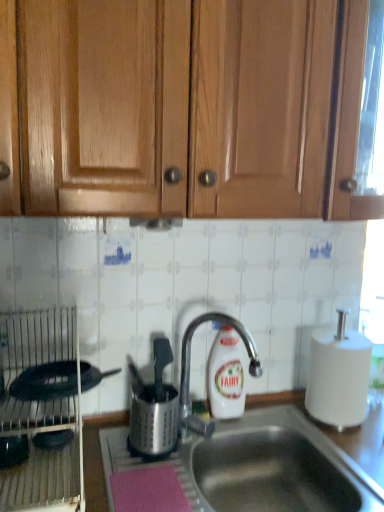
Question: From the image's perspective, is white plastic bottle at center located above or below wooden cabinet doors at upper center?

Choices:
 (A) below
 (B) above

Answer: (A)

Question: Looking at the image, does white plastic bottle at center seem bigger or smaller compared to wooden cabinet doors at upper center?

Choices:
 (A) big
 (B) small

Answer: (B)

Question: Which object is positioned farthest from the white matte paper towel at right?

Choices:
 (A) wooden cabinet doors at upper center
 (B) white plastic bottle at center
 (C) satin silver utensil holder at center, the 1th appliance from the right
 (D) stainless steel sink at center
 (E) silver metallic faucet at center

Answer: (A)

Question: Based on their relative distances, which object is farther from the wooden cabinet doors at upper center?

Choices:
 (A) satin silver utensil holder at center, which is counted as the 2th appliance, starting from the left
 (B) silver metallic faucet at center
 (C) stainless steel sink at center
 (D) metallic silver dish rack at left, which ranks as the first appliance in left-to-right order
 (E) white plastic bottle at center

Answer: (C)